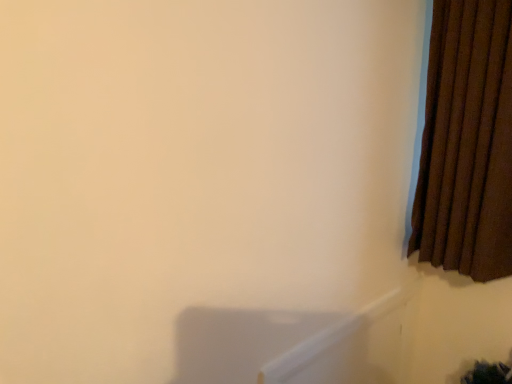
Describe the element at coordinates (467, 142) in the screenshot. Image resolution: width=512 pixels, height=384 pixels. I see `brown textured curtain at right` at that location.

Locate an element on the screen. brown textured curtain at right is located at coordinates (467, 142).

This screenshot has height=384, width=512. I want to click on brown textured curtain at right, so click(x=467, y=142).